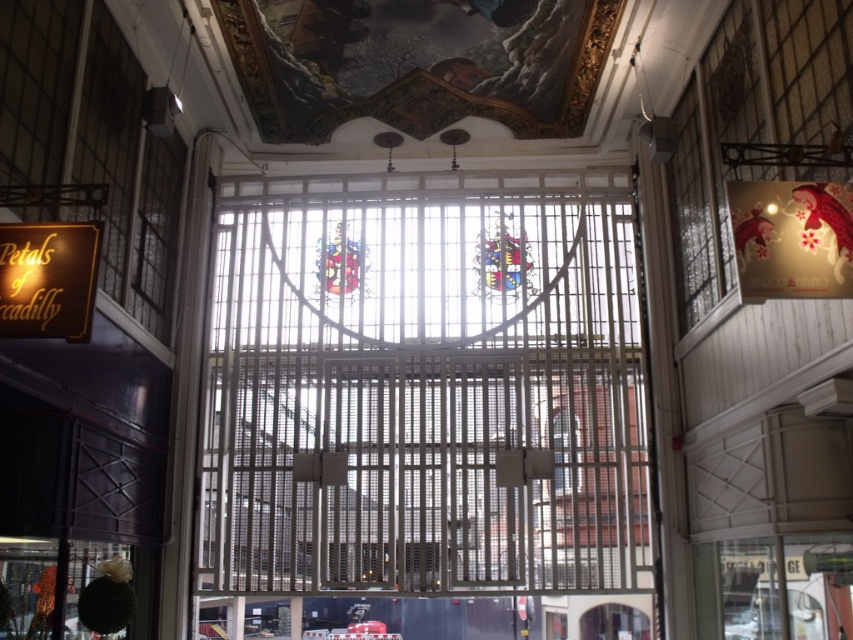
You are standing in the grand building and looking at the ornate metal gate. There are two points marked on the gate, one at coordinate point [294,566] and the other at point [84,248]. Which point is closer to you?

Point [84,248] is closer to you because it is nearer to the camera compared to point [294,566] which is further away.